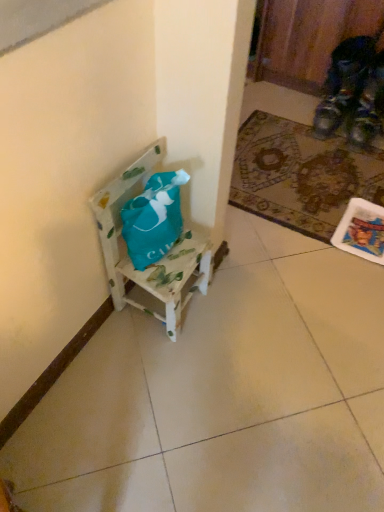
You are a GUI agent. You are given a task and a screenshot of the screen. Output one action in this format:
    pyautogui.click(x=<x>, y=<y>)
    Task: Click on the free point below patterned carpet at lower right (from a real-world perspective)
    The height and width of the screenshot is (512, 384).
    Given the screenshot: What is the action you would take?
    pyautogui.click(x=314, y=184)